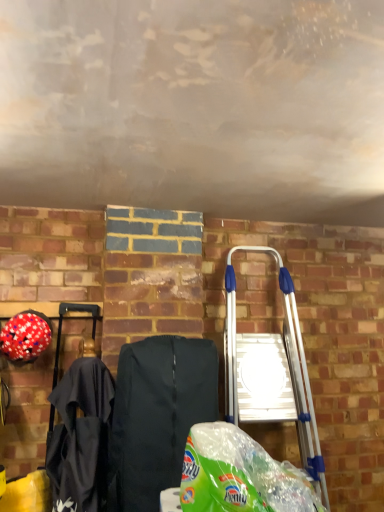
Question: Considering the relative sizes of silver metallic ladder at right and black fabric folding chair at center in the image provided, is silver metallic ladder at right bigger than black fabric folding chair at center?

Choices:
 (A) yes
 (B) no

Answer: (A)

Question: Does silver metallic ladder at right have a greater height compared to black fabric folding chair at center?

Choices:
 (A) no
 (B) yes

Answer: (B)

Question: From the image's perspective, would you say silver metallic ladder at right is positioned over black fabric folding chair at center?

Choices:
 (A) no
 (B) yes

Answer: (B)

Question: Is black fabric folding chair at center at the back of silver metallic ladder at right?

Choices:
 (A) yes
 (B) no

Answer: (B)

Question: Could black fabric folding chair at center be considered to be inside silver metallic ladder at right?

Choices:
 (A) yes
 (B) no

Answer: (B)

Question: Considering the positions of red matte helmet at left and green plastic grocery bag at lower center in the image, is red matte helmet at left taller or shorter than green plastic grocery bag at lower center?

Choices:
 (A) short
 (B) tall

Answer: (A)

Question: Looking at the image, does red matte helmet at left seem bigger or smaller compared to green plastic grocery bag at lower center?

Choices:
 (A) big
 (B) small

Answer: (B)

Question: Looking at their shapes, would you say red matte helmet at left is wider or thinner than green plastic grocery bag at lower center?

Choices:
 (A) wide
 (B) thin

Answer: (B)

Question: From a real-world perspective, relative to green plastic grocery bag at lower center, is red matte helmet at left vertically above or below?

Choices:
 (A) above
 (B) below

Answer: (A)

Question: From the image's perspective, is green plastic grocery bag at lower center positioned above or below red matte helmet at left?

Choices:
 (A) below
 (B) above

Answer: (A)

Question: Considering the positions of green plastic grocery bag at lower center and red matte helmet at left in the image, is green plastic grocery bag at lower center bigger or smaller than red matte helmet at left?

Choices:
 (A) small
 (B) big

Answer: (B)

Question: Looking at their shapes, would you say green plastic grocery bag at lower center is wider or thinner than red matte helmet at left?

Choices:
 (A) thin
 (B) wide

Answer: (B)

Question: Is green plastic grocery bag at lower center in front of or behind red matte helmet at left in the image?

Choices:
 (A) behind
 (B) front

Answer: (B)

Question: Is black fabric folding chair at center in front of or behind red matte helmet at left in the image?

Choices:
 (A) front
 (B) behind

Answer: (A)

Question: Considering the positions of black fabric folding chair at center and red matte helmet at left in the image, is black fabric folding chair at center wider or thinner than red matte helmet at left?

Choices:
 (A) thin
 (B) wide

Answer: (B)